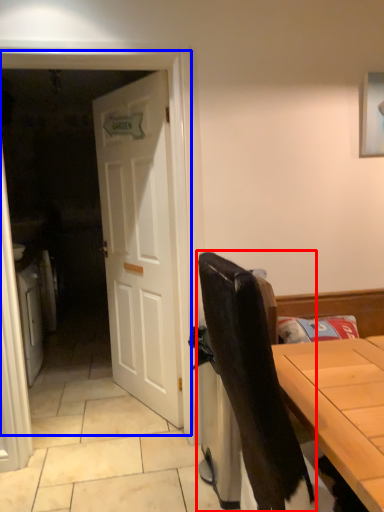
Question: Among these objects, which one is nearest to the camera, chair (highlighted by a red box) or screen door (highlighted by a blue box)?

Choices:
 (A) chair
 (B) screen door

Answer: (A)